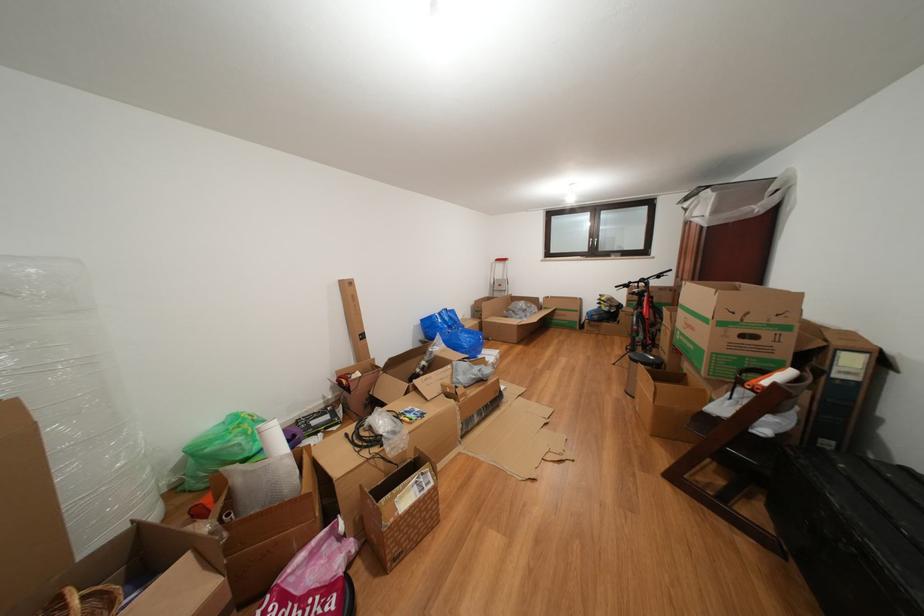
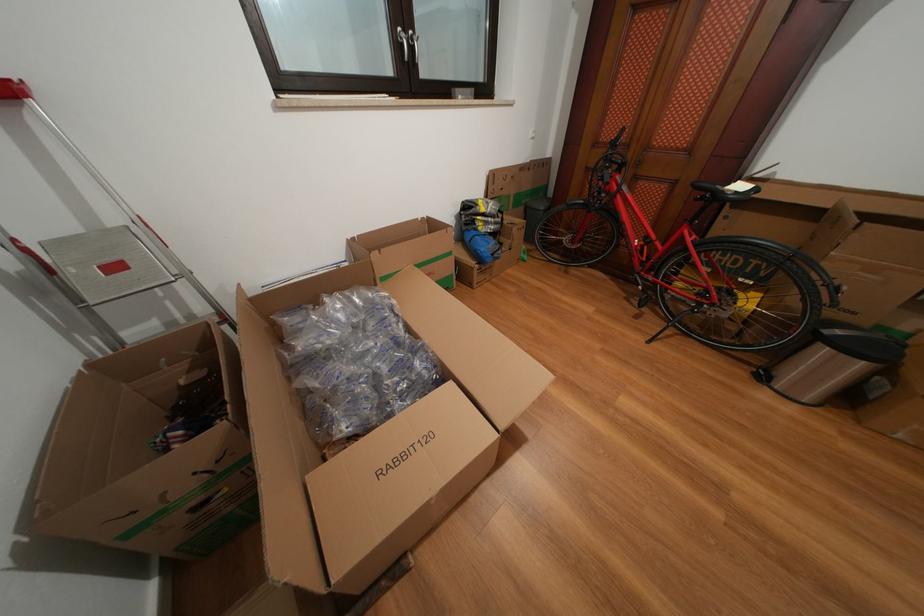
The point at (611, 304) is marked in the first image. Where is the corresponding point in the second image?

(491, 215)